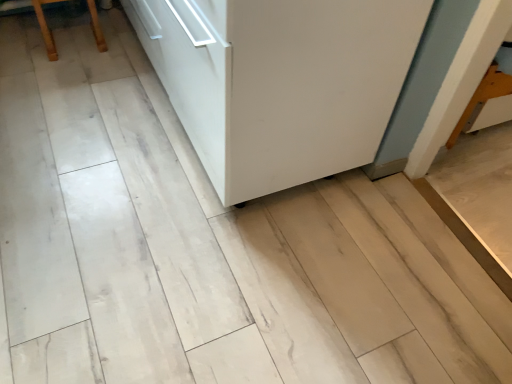
Where is `free space in front of wooden chair legs at upper left`? The height and width of the screenshot is (384, 512). free space in front of wooden chair legs at upper left is located at coordinates (67, 83).